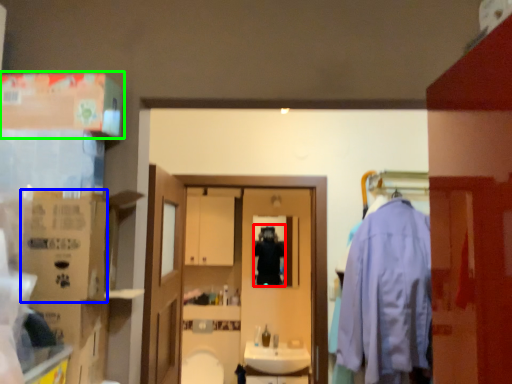
Question: Considering the real-world distances, which object is closest to person (highlighted by a red box)? cardboard box (highlighted by a blue box) or box (highlighted by a green box).

Choices:
 (A) cardboard box
 (B) box

Answer: (B)